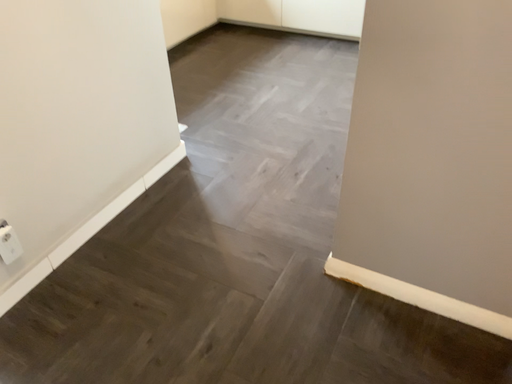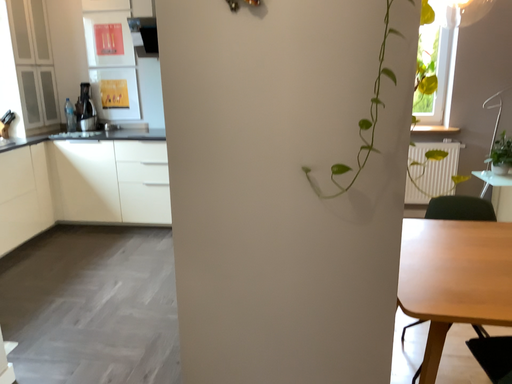
Question: How did the camera likely rotate when shooting the video?

Choices:
 (A) rotated right
 (B) rotated left

Answer: (A)